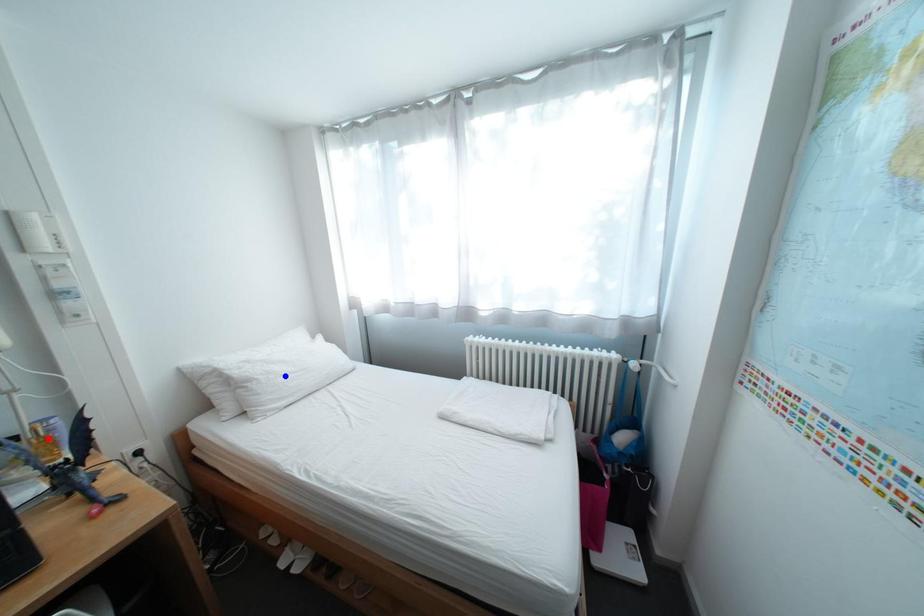
Question: Which of the two points in the image is closer to the camera?

Choices:
 (A) Blue point is closer.
 (B) Red point is closer.

Answer: (B)